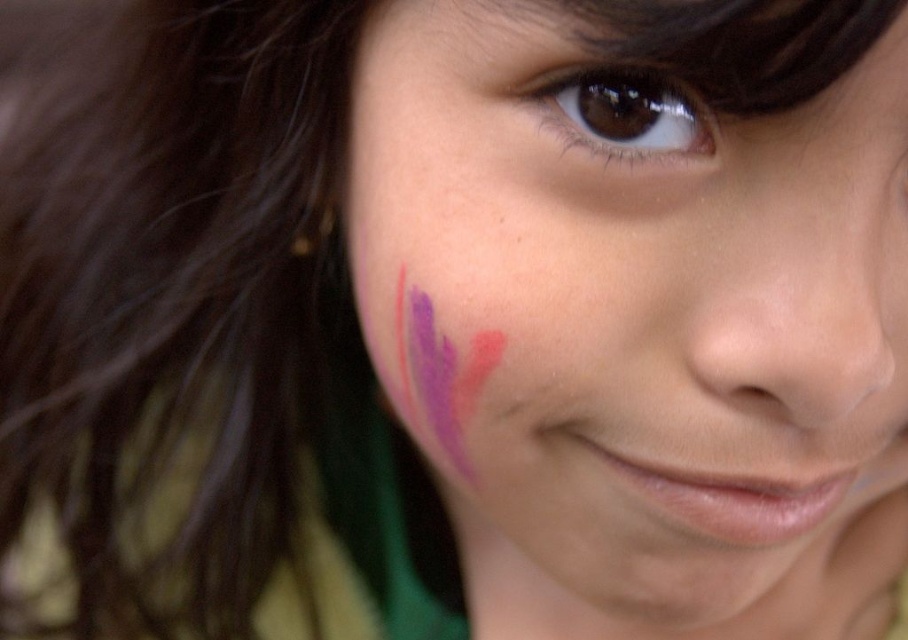
From the picture: You are an artist trying to touch up the paint splashes on the face. You have two points to consider, point (390, 282) and point (638, 134). Which point is closer to your brush if you are working from the front of the face?

Point (390, 282) is further to the viewer than point (638, 134), so the point (390, 282) is closer to your brush since it is nearer to you as the artist working from the front of the face.

Based on the photo, you are an artist trying to touch up the purple matte paint at left and the brown glossy eye at upper center. Which object is taller in the image?

The purple matte paint at left is much taller than the brown glossy eye at upper center.

You are an artist trying to replicate this portrait. You need to place the purple matte paint at left and the brown glossy eye at upper center. Based on the original image, which object should you paint first to ensure proper layering?

The brown glossy eye at upper center should be painted first because the purple matte paint at left is located below it, meaning the eye needs to be placed on top of the paint for proper layering.